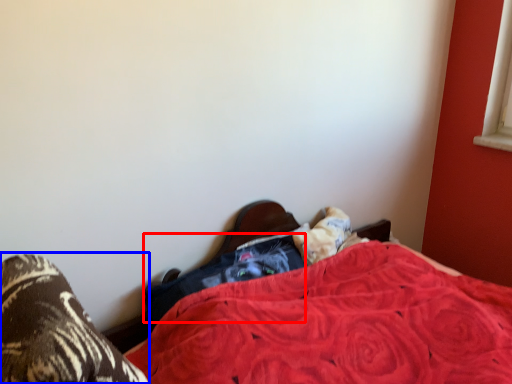
Question: Which of the following is the farthest to the observer, clothing (highlighted by a red box) or footwear (highlighted by a blue box)?

Choices:
 (A) clothing
 (B) footwear

Answer: (A)